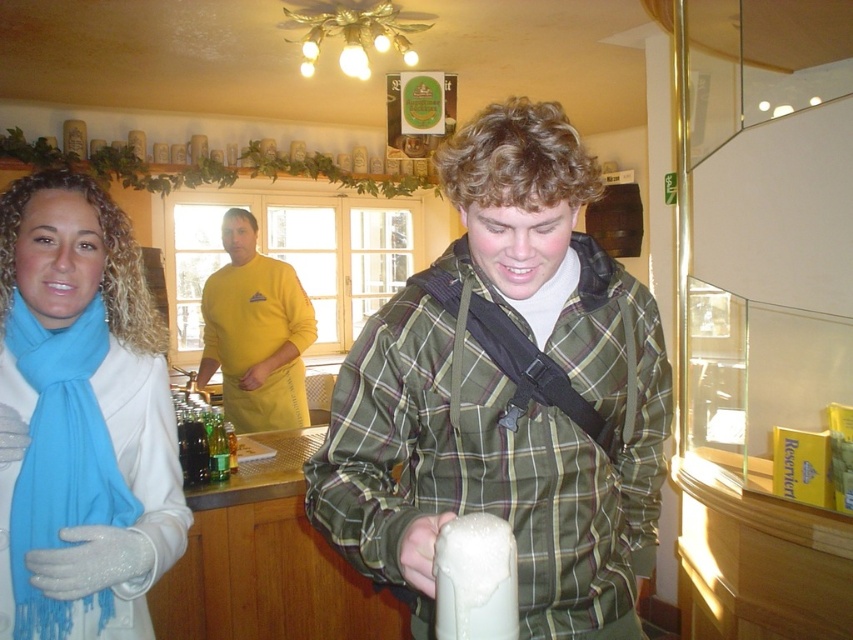
Question: Can you confirm if green plaid jacket at center is positioned below green glass bottles at center?

Choices:
 (A) no
 (B) yes

Answer: (A)

Question: Considering the relative positions of green plaid jacket at center and green glass bottles at center in the image provided, where is green plaid jacket at center located with respect to green glass bottles at center?

Choices:
 (A) left
 (B) right

Answer: (B)

Question: Estimate the real-world distances between objects in this image. Which object is farther from the turquoise soft scarf at left?

Choices:
 (A) green plaid jacket at center
 (B) green glass bottles at center

Answer: (B)

Question: Which object appears closest to the camera in this image?

Choices:
 (A) yellow fabric shirt at center
 (B) green plaid jacket at center

Answer: (B)

Question: Among these objects, which one is farthest from the camera?

Choices:
 (A) turquoise soft scarf at left
 (B) yellow fabric shirt at center
 (C) green plaid jacket at center

Answer: (B)

Question: Does green plaid jacket at center appear on the left side of turquoise soft scarf at left?

Choices:
 (A) yes
 (B) no

Answer: (B)